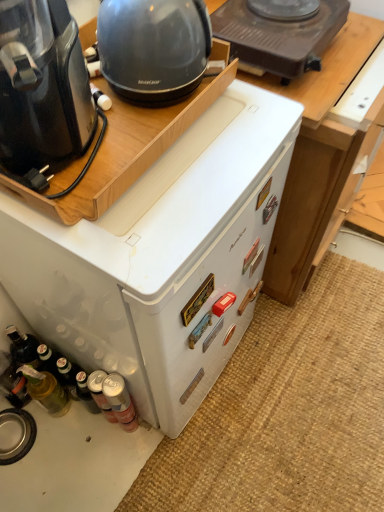
I want to click on vacant space situated above white matte refrigerator at center, positioned as the second home appliance in front-to-back order (from a real-world perspective), so click(x=149, y=161).